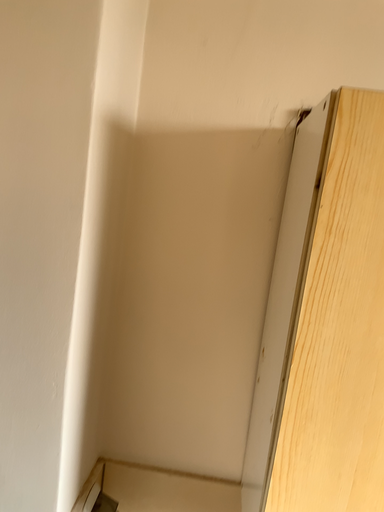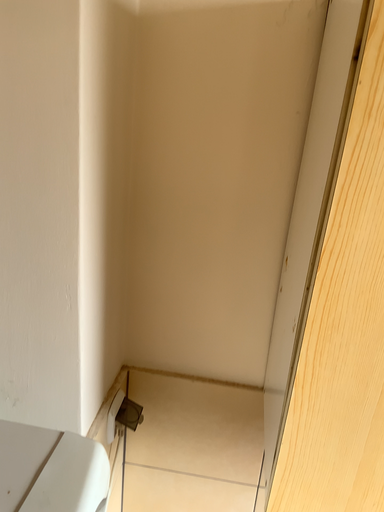
Question: How did the camera likely rotate when shooting the video?

Choices:
 (A) rotated downward
 (B) rotated upward

Answer: (A)